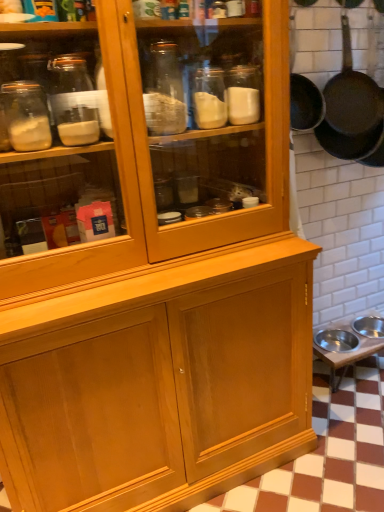
Find the location of a particular element. metallic silver table at lower right is located at coordinates (345, 351).

Describe the element at coordinates (345, 351) in the screenshot. This screenshot has height=512, width=384. I see `metallic silver table at lower right` at that location.

Measure the distance between point (348, 362) and camera.

Point (348, 362) is 1.98 meters away from camera.

What do you see at coordinates (351, 109) in the screenshot? I see `dark brown matte frying pan at upper right` at bounding box center [351, 109].

You are a GUI agent. You are given a task and a screenshot of the screen. Output one action in this format:
    pyautogui.click(x=<x>, y=<y>)
    Task: Click on the dark brown matte frying pan at upper right
    The image size is (384, 512).
    Given the screenshot: What is the action you would take?
    (x=351, y=109)

Locate an element on the screen. The image size is (384, 512). metallic silver table at lower right is located at coordinates (345, 351).

Would you say metallic silver table at lower right is to the left or to the right of dark brown matte frying pan at upper right in the picture?

metallic silver table at lower right is positioned on dark brown matte frying pan at upper right's right side.

Which is behind, metallic silver table at lower right or dark brown matte frying pan at upper right?

metallic silver table at lower right.

Is point (364, 347) positioned in front of point (362, 77)?

That is False.

From the image's perspective, is metallic silver table at lower right below dark brown matte frying pan at upper right?

Yes.

From a real-world perspective, is metallic silver table at lower right above or below dark brown matte frying pan at upper right?

In terms of real-world spatial position, metallic silver table at lower right is below dark brown matte frying pan at upper right.

Looking at their sizes, would you say metallic silver table at lower right is wider or thinner than dark brown matte frying pan at upper right?

In the image, metallic silver table at lower right appears to be wider than dark brown matte frying pan at upper right.

Is metallic silver table at lower right shorter than dark brown matte frying pan at upper right?

Indeed, metallic silver table at lower right has a lesser height compared to dark brown matte frying pan at upper right.

Who is smaller, metallic silver table at lower right or dark brown matte frying pan at upper right?

With smaller size is dark brown matte frying pan at upper right.

Is metallic silver table at lower right located outside dark brown matte frying pan at upper right?

Yes, metallic silver table at lower right is not within dark brown matte frying pan at upper right.

Looking at this image, is metallic silver table at lower right positioned far away from dark brown matte frying pan at upper right?

Actually, metallic silver table at lower right and dark brown matte frying pan at upper right are a little close together.

Is metallic silver table at lower right looking in the opposite direction of dark brown matte frying pan at upper right?

No, dark brown matte frying pan at upper right is not at the back of metallic silver table at lower right.

Locate an element on the screen. This screenshot has height=512, width=384. table that appears below the dark brown matte frying pan at upper right (from the image's perspective) is located at coordinates (345, 351).

In the image, is dark brown matte frying pan at upper right on the left side or the right side of metallic silver table at lower right?

From the image, it's evident that dark brown matte frying pan at upper right is to the left of metallic silver table at lower right.

Is dark brown matte frying pan at upper right in front of or behind metallic silver table at lower right in the image?

Clearly, dark brown matte frying pan at upper right is in front of metallic silver table at lower right.

Is point (364, 123) positioned before point (364, 315)?

Yes, it is in front of point (364, 315).

From the image's perspective, is dark brown matte frying pan at upper right beneath metallic silver table at lower right?

No, from the image's perspective, dark brown matte frying pan at upper right is not beneath metallic silver table at lower right.

From a real-world perspective, is dark brown matte frying pan at upper right physically located above or below metallic silver table at lower right?

dark brown matte frying pan at upper right is situated higher than metallic silver table at lower right in the real world.

Considering the relative sizes of dark brown matte frying pan at upper right and metallic silver table at lower right in the image provided, is dark brown matte frying pan at upper right thinner than metallic silver table at lower right?

Yes.

Can you confirm if dark brown matte frying pan at upper right is shorter than metallic silver table at lower right?

Incorrect, the height of dark brown matte frying pan at upper right does not fall short of that of metallic silver table at lower right.

Does dark brown matte frying pan at upper right have a smaller size compared to metallic silver table at lower right?

Yes, dark brown matte frying pan at upper right is smaller than metallic silver table at lower right.

Would you say dark brown matte frying pan at upper right is inside or outside metallic silver table at lower right?

dark brown matte frying pan at upper right is located beyond the bounds of metallic silver table at lower right.

Would you say dark brown matte frying pan at upper right is a long distance from metallic silver table at lower right?

dark brown matte frying pan at upper right is near metallic silver table at lower right, not far away.

Could you tell me if dark brown matte frying pan at upper right is facing metallic silver table at lower right?

No, dark brown matte frying pan at upper right is not aimed at metallic silver table at lower right.

Measure the distance between dark brown matte frying pan at upper right and metallic silver table at lower right.

A distance of 37.54 inches exists between dark brown matte frying pan at upper right and metallic silver table at lower right.

Identify the location of frying pan on the left of metallic silver table at lower right. Image resolution: width=384 pixels, height=512 pixels. (351, 109).

Identify the location of table that is on the right side of dark brown matte frying pan at upper right. (345, 351).

Image resolution: width=384 pixels, height=512 pixels. Find the location of `frying pan to the left of metallic silver table at lower right`. frying pan to the left of metallic silver table at lower right is located at coordinates (351, 109).